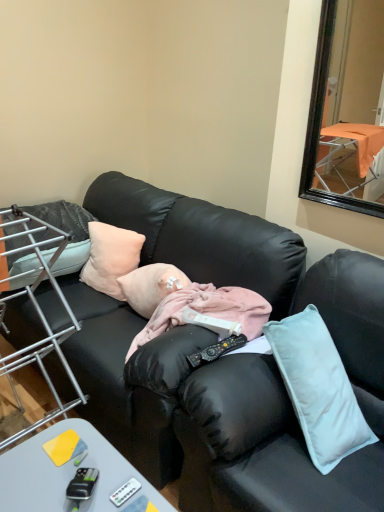
The width and height of the screenshot is (384, 512). Find the location of `blank space to the left of white plastic remote control at lower center, which is the second remote control from back to front`. blank space to the left of white plastic remote control at lower center, which is the second remote control from back to front is located at coordinates tap(68, 480).